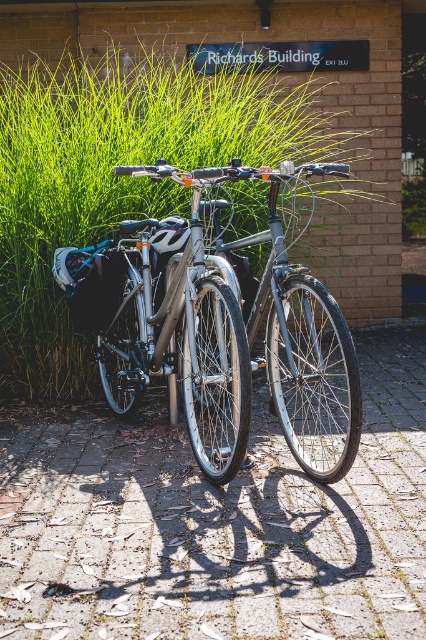
Describe the element at coordinates (215, 520) in the screenshot. This screenshot has width=426, height=640. I see `brick pavement at center` at that location.

The width and height of the screenshot is (426, 640). Describe the element at coordinates (215, 520) in the screenshot. I see `brick pavement at center` at that location.

In order to click on brick pavement at center in this screenshot , I will do `click(215, 520)`.

From the picture: Between brick pavement at center and shiny metallic bicycle at center, which one is positioned lower?

brick pavement at center is below.

The width and height of the screenshot is (426, 640). Describe the element at coordinates (215, 520) in the screenshot. I see `brick pavement at center` at that location.

This screenshot has width=426, height=640. What are the coordinates of `brick pavement at center` in the screenshot? It's located at (215, 520).

In the scene shown: Can you confirm if green grass at center is taller than shiny metallic bicycle at center?

Correct, green grass at center is much taller as shiny metallic bicycle at center.

Is green grass at center positioned in front of shiny metallic bicycle at center?

That is False.

Locate an element on the screen. The width and height of the screenshot is (426, 640). green grass at center is located at coordinates (117, 177).